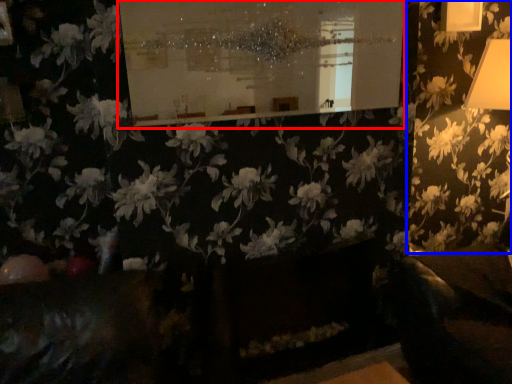
Question: Which point is further to the camera, bulletin board (highlighted by a red box) or flower (highlighted by a blue box)?

Choices:
 (A) bulletin board
 (B) flower

Answer: (B)